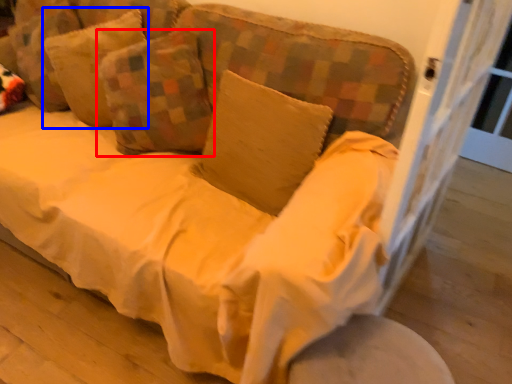
Question: Which point is closer to the camera, pillow (highlighted by a red box) or pillow (highlighted by a blue box)?

Choices:
 (A) pillow
 (B) pillow

Answer: (A)